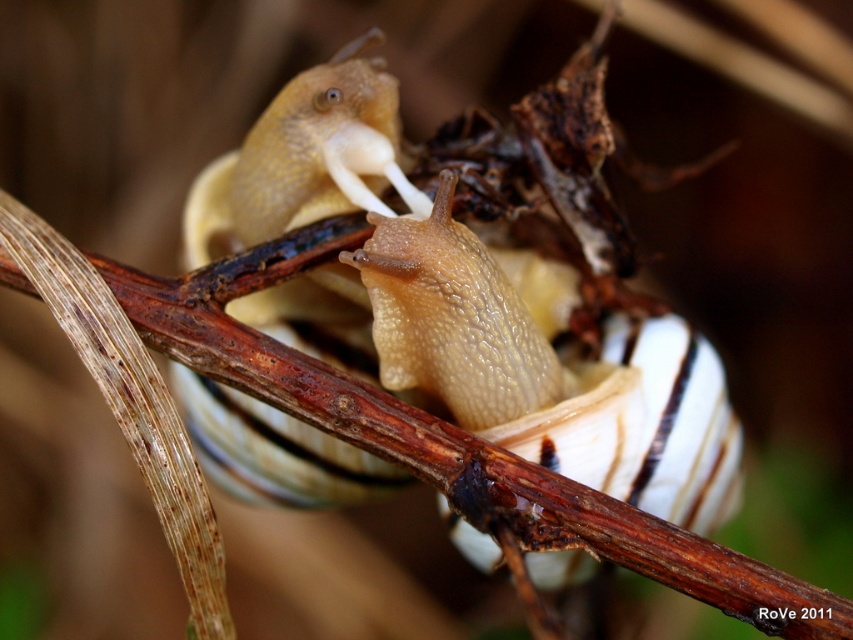
Does glossy beige snail at center have a larger size compared to brown rough tree branch at center?

Indeed, glossy beige snail at center has a larger size compared to brown rough tree branch at center.

From the picture: Does glossy beige snail at center have a greater width compared to brown rough tree branch at center?

Incorrect, glossy beige snail at center's width does not surpass brown rough tree branch at center's.

Does point (679, 320) lie in front of point (785, 577)?

No, (679, 320) is further to viewer.

At what (x,y) coordinates should I click in order to perform the action: click on glossy beige snail at center. Please return your answer as a coordinate pair (x, y). This screenshot has height=640, width=853. Looking at the image, I should click on (550, 369).

At what (x,y) coordinates should I click in order to perform the action: click on glossy beige snail at center. Please return your answer as a coordinate pair (x, y). Looking at the image, I should click on (550, 369).

Between brown rough tree branch at center and translucent beige snail at center, which one appears on the left side from the viewer's perspective?

translucent beige snail at center

Between point (479, 467) and point (218, 429), which one is positioned in front?

Point (479, 467) is more forward.

You are a GUI agent. You are given a task and a screenshot of the screen. Output one action in this format:
    pyautogui.click(x=<x>, y=<y>)
    Task: Click on the brown rough tree branch at center
    The width and height of the screenshot is (853, 640).
    Given the screenshot: What is the action you would take?
    pyautogui.click(x=357, y=440)